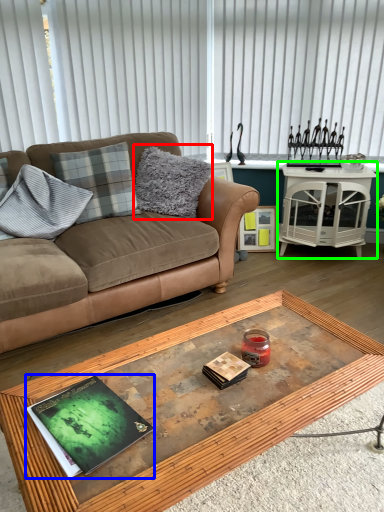
Question: Considering the real-world distances, which object is farthest from pillow (highlighted by a red box)? magazine (highlighted by a blue box) or table (highlighted by a green box)?

Choices:
 (A) magazine
 (B) table

Answer: (A)